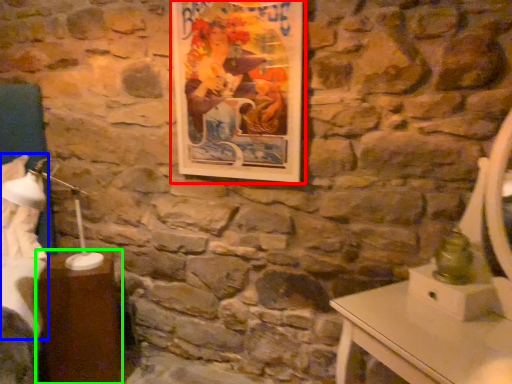
Question: Based on their relative distances, which object is nearer to picture frame (highlighted by a red box)? Choose from sheet (highlighted by a blue box) and table (highlighted by a green box).

Choices:
 (A) sheet
 (B) table

Answer: (B)